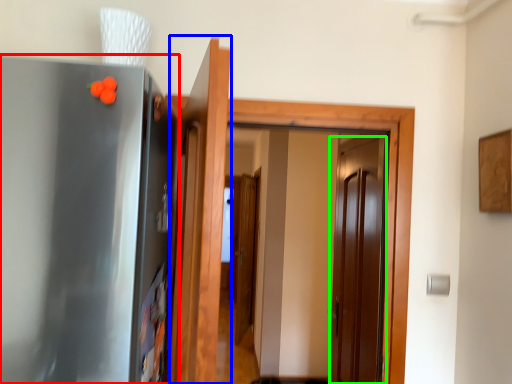
Question: Which object is the farthest from appliance (highlighted by a red box)? Choose among these: door (highlighted by a blue box) or door (highlighted by a green box).

Choices:
 (A) door
 (B) door

Answer: (B)